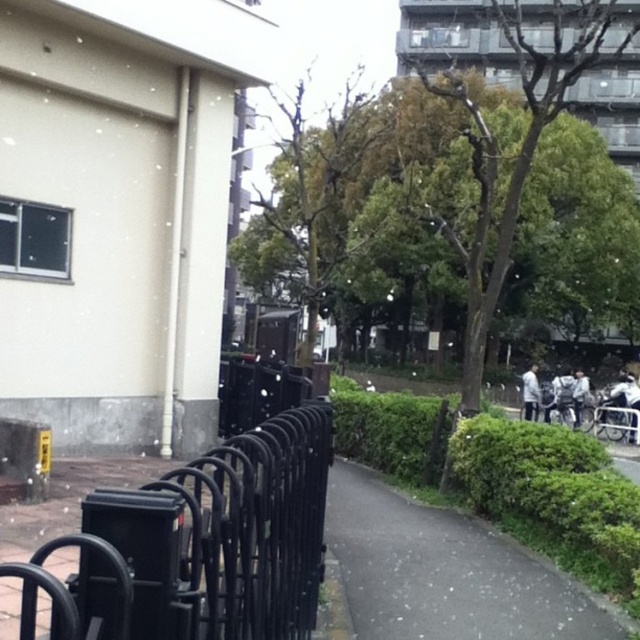
You are standing at the edge of the green grass at lower right and want to walk towards the black metal fence at left. Which direction should you move to reach it?

The black metal fence at left is located above the green grass at lower right, so you should move upwards to reach it.

You are standing on the sidewalk made of reddish brown bricks and want to find the black metal fence at left. According to the image, where is the black metal fence at left located relative to the point with coordinates (198, 545)?

The point with coordinates (198, 545) indicates the location of the black metal fence at left, so it is exactly at that position.